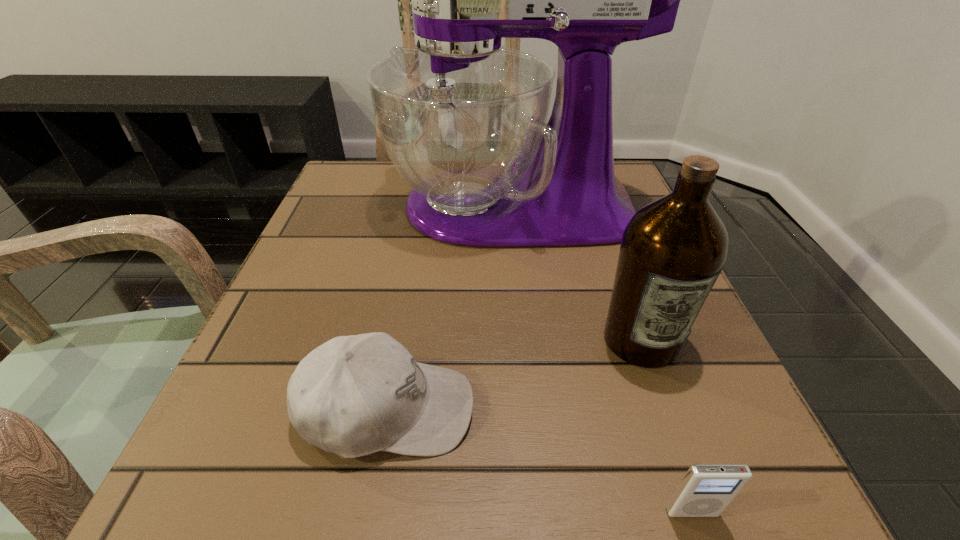
You are a GUI agent. You are given a task and a screenshot of the screen. Output one action in this format:
    pyautogui.click(x=<x>, y=<y>)
    Task: Click on the baseball cap situated at the near edge
    The width and height of the screenshot is (960, 540).
    Given the screenshot: What is the action you would take?
    pyautogui.click(x=355, y=395)

This screenshot has height=540, width=960. Identify the location of iPod positioned at the near edge. (706, 490).

Locate an element on the screen. The height and width of the screenshot is (540, 960). mixer located in the left edge section of the desktop is located at coordinates (463, 119).

This screenshot has width=960, height=540. Find the location of `baseball cap present at the left edge`. baseball cap present at the left edge is located at coordinates (355, 395).

You are a GUI agent. You are given a task and a screenshot of the screen. Output one action in this format:
    pyautogui.click(x=<x>, y=<y>)
    Task: Click on the mixer that is at the right edge
    Image resolution: width=960 pixels, height=540 pixels.
    Given the screenshot: What is the action you would take?
    pyautogui.click(x=463, y=119)

At what (x,y) coordinates should I click in order to perform the action: click on olive oil located at the right edge. Please return your answer as a coordinate pair (x, y). Looking at the image, I should click on (673, 249).

Image resolution: width=960 pixels, height=540 pixels. I want to click on iPod present at the right edge, so 706,490.

Find the location of a particular element. The image size is (960, 540). object at the far left corner is located at coordinates click(x=463, y=119).

You are a GUI agent. You are given a task and a screenshot of the screen. Output one action in this format:
    pyautogui.click(x=<x>, y=<y>)
    Task: Click on the object located in the near left corner section of the desktop
    This screenshot has width=960, height=540.
    Given the screenshot: What is the action you would take?
    pyautogui.click(x=355, y=395)

Identify the location of object that is at the far right corner. This screenshot has height=540, width=960. (463, 119).